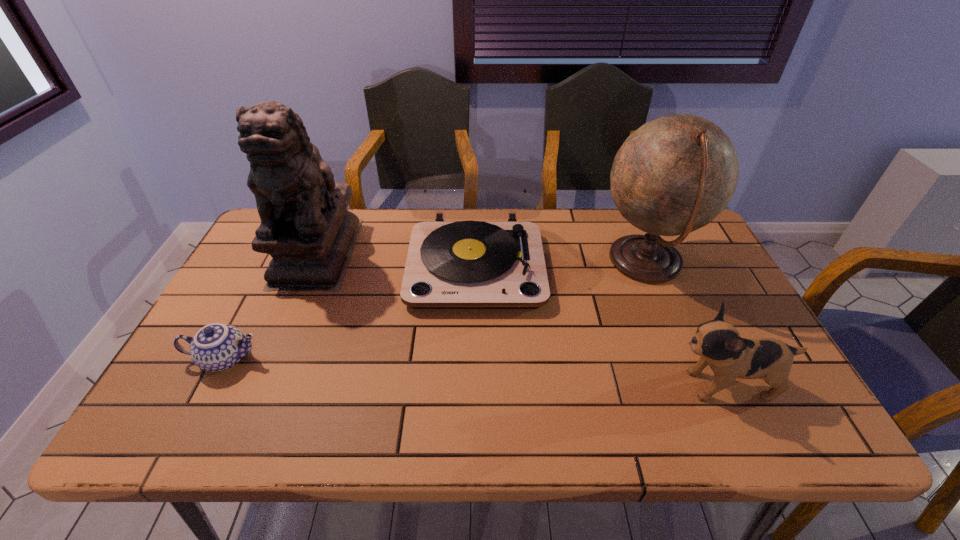
Locate an element on the screen. vacant space that satisfies the following two spatial constraints: 1. with the tonearm facing the front of the third object from right to left; 2. from the spout of the shortest object is located at coordinates (474, 359).

You are a GUI agent. You are given a task and a screenshot of the screen. Output one action in this format:
    pyautogui.click(x=<x>, y=<y>)
    Task: Click on the vacant position in the image that satisfies the following two spatial constraints: 1. on the front-facing side of the sculpture; 2. from the spout of the shortest object
    This screenshot has height=540, width=960.
    Given the screenshot: What is the action you would take?
    tap(273, 359)